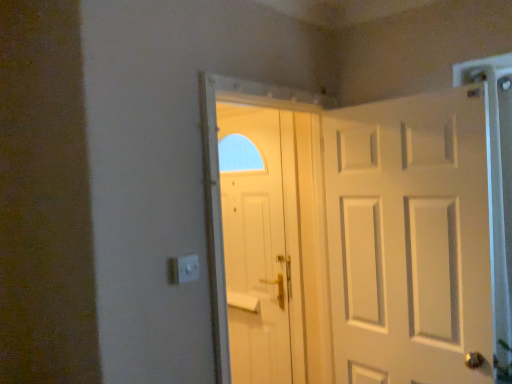
Question: From the image's perspective, is white matte door at center, which ranks as the 2th door in front-to-back order, located above or below white matte door at right, which is the 2th door from left to right?

Choices:
 (A) below
 (B) above

Answer: (A)

Question: Based on their sizes in the image, would you say white matte door at center, placed as the first door when sorted from back to front, is bigger or smaller than white matte door at right, the 2th door in the back-to-front sequence?

Choices:
 (A) big
 (B) small

Answer: (B)

Question: Looking at their shapes, would you say white matte door at center, which ranks as the second door in right-to-left order, is wider or thinner than white matte door at right, the 1th door viewed from the front?

Choices:
 (A) thin
 (B) wide

Answer: (A)

Question: Choose the correct answer: Is white matte door at right, the 2th door in the back-to-front sequence, inside white matte door at center, placed as the first door when sorted from back to front, or outside it?

Choices:
 (A) inside
 (B) outside

Answer: (B)

Question: Looking at their shapes, would you say white matte door at right, the 1th door viewed from the front, is wider or thinner than white matte door at center, which ranks as the second door in right-to-left order?

Choices:
 (A) wide
 (B) thin

Answer: (A)

Question: From a real-world perspective, is white matte door at right, which is the 2th door from left to right, physically located above or below white matte door at center, acting as the first door starting from the left?

Choices:
 (A) below
 (B) above

Answer: (B)

Question: Considering the relative positions of white matte door at right, which is the 2th door from left to right, and white matte door at center, acting as the first door starting from the left, in the image provided, is white matte door at right, which is the 2th door from left to right, to the left or to the right of white matte door at center, acting as the first door starting from the left,?

Choices:
 (A) right
 (B) left

Answer: (A)